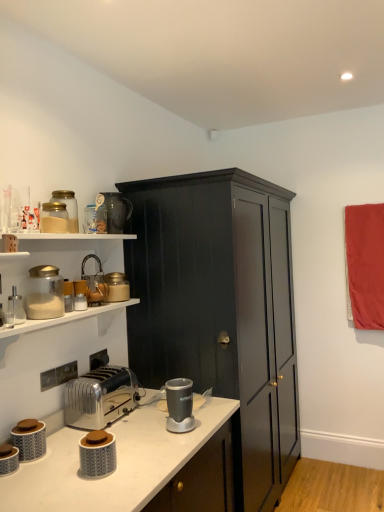
This screenshot has height=512, width=384. Find the location of `free space above red fabric curtain at right (from a real-world perspective)`. free space above red fabric curtain at right (from a real-world perspective) is located at coordinates (363, 204).